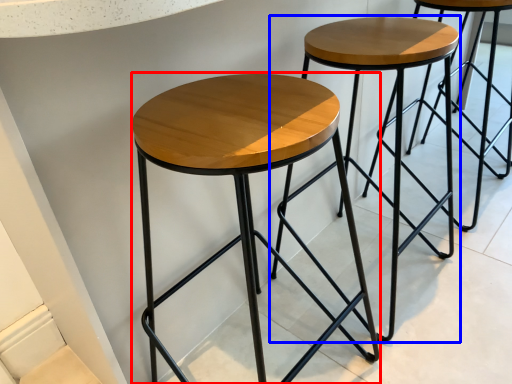
Question: Which of the following is the farthest to the observer, stool (highlighted by a red box) or stool (highlighted by a blue box)?

Choices:
 (A) stool
 (B) stool

Answer: (B)